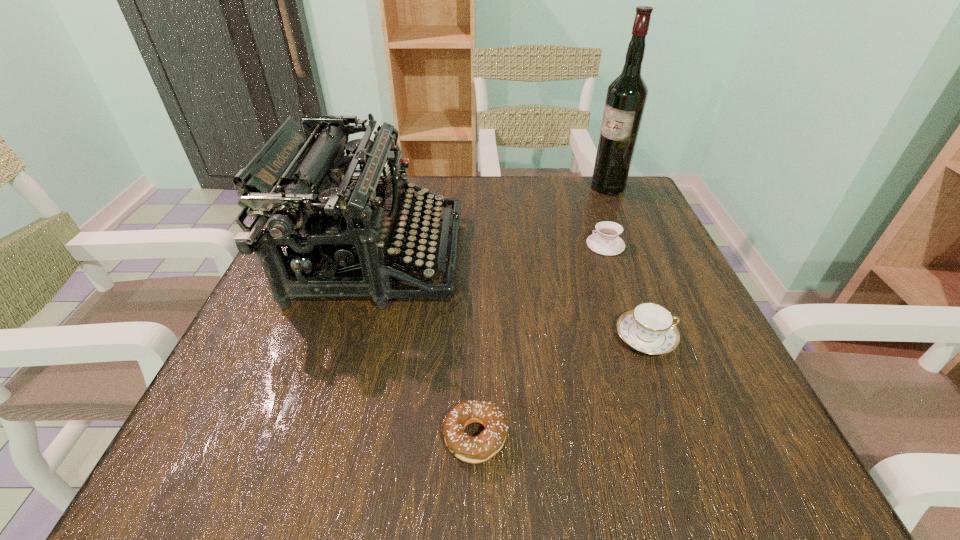
In order to click on vacant space that satisfies the following two spatial constraints: 1. on the typing side of the doughnut; 2. on the right side of the second tallest object in this screenshot , I will do `click(327, 437)`.

I want to click on vacant point that satisfies the following two spatial constraints: 1. on the front and back of the farthest object; 2. on the front side of the doughnut, so click(x=716, y=437).

Locate an element on the screen. This screenshot has height=540, width=960. free space that satisfies the following two spatial constraints: 1. on the side with the handle of the nearer teacup; 2. on the front side of the nearest object is located at coordinates (683, 437).

Identify the location of free space that satisfies the following two spatial constraints: 1. on the typing side of the second tallest object; 2. on the right side of the doughnut. (327, 437).